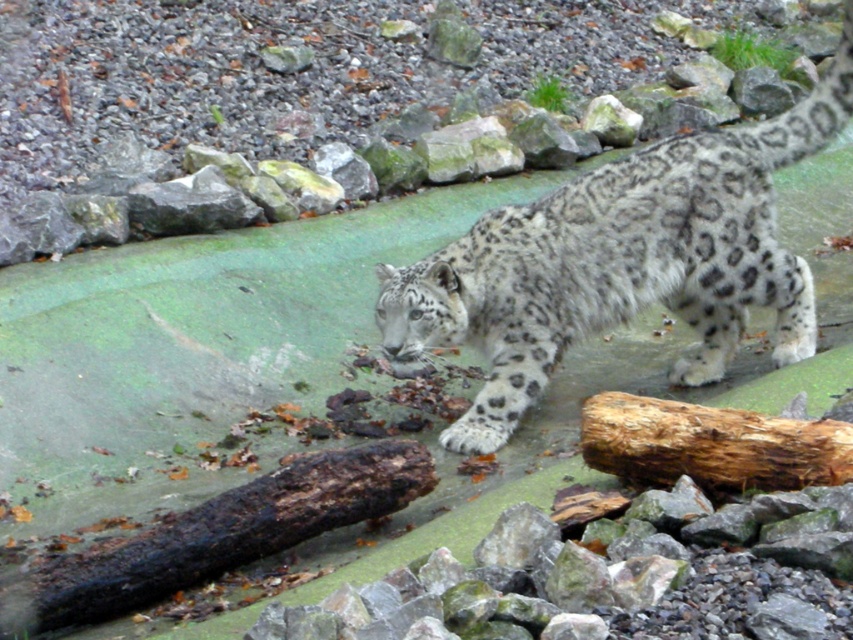
You are a zookeeper observing the snowy fur snow leopard at center and the rough brown log at lower right. Which object is positioned higher in the image?

The snowy fur snow leopard at center is positioned higher than the rough brown log at lower right.

You are a zookeeper observing the snowy fur snow leopard at center and the rough brown log at lower right in the enclosure. Which object takes up more space in the image?

The snowy fur snow leopard at center takes up more space in the image because it has a larger size compared to the rough brown log at lower right.